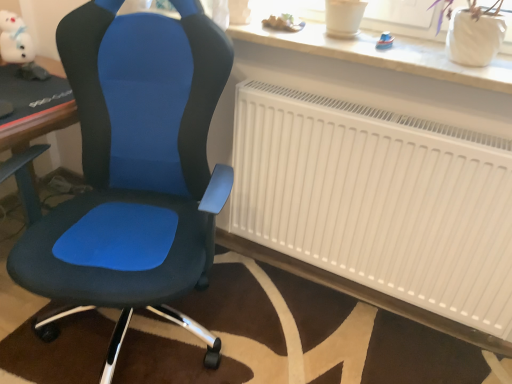
Question: Relative to white plush toy at upper left, arranged as the 3th toy when viewed from the front, is wooden toy boat at upper center, which ranks as the second toy in front-to-back order, in front or behind?

Choices:
 (A) front
 (B) behind

Answer: (A)

Question: Considering the positions of wooden toy boat at upper center, placed as the second toy when sorted from right to left, and white plush toy at upper left, the first toy positioned from the back, in the image, is wooden toy boat at upper center, placed as the second toy when sorted from right to left, taller or shorter than white plush toy at upper left, the first toy positioned from the back,?

Choices:
 (A) short
 (B) tall

Answer: (A)

Question: Which of these objects is positioned farthest from the matte blue fabric chair at center?

Choices:
 (A) white plush toy at upper left, the first toy positioned from the left
 (B) white matte radiator at center
 (C) blue plastic toy at upper right, acting as the 3th toy starting from the left
 (D) wooden toy boat at upper center, which ranks as the second toy in front-to-back order

Answer: (C)

Question: Considering the real-world distances, which object is farthest from the white plush toy at upper left, arranged as the 3th toy when viewed from the front?

Choices:
 (A) wooden toy boat at upper center, which ranks as the second toy in back-to-front order
 (B) blue plastic toy at upper right, arranged as the 1th toy when viewed from the right
 (C) matte blue fabric chair at center
 (D) white matte radiator at center

Answer: (B)